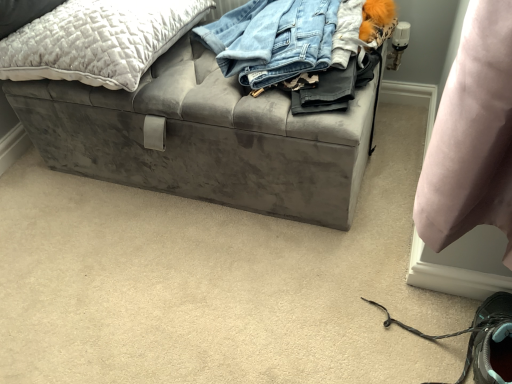
Question: Considering the relative sizes of quilted gray pillow at upper left and gray suede shoe at lower right in the image provided, is quilted gray pillow at upper left thinner than gray suede shoe at lower right?

Choices:
 (A) no
 (B) yes

Answer: (A)

Question: From the image's perspective, would you say quilted gray pillow at upper left is shown under gray suede shoe at lower right?

Choices:
 (A) no
 (B) yes

Answer: (A)

Question: Considering the relative positions of quilted gray pillow at upper left and gray suede shoe at lower right in the image provided, is quilted gray pillow at upper left to the left of gray suede shoe at lower right from the viewer's perspective?

Choices:
 (A) no
 (B) yes

Answer: (B)

Question: Does quilted gray pillow at upper left appear on the right side of gray suede shoe at lower right?

Choices:
 (A) no
 (B) yes

Answer: (A)

Question: Is quilted gray pillow at upper left positioned far away from gray suede shoe at lower right?

Choices:
 (A) no
 (B) yes

Answer: (A)

Question: From a real-world perspective, relative to quilted gray pillow at upper left, is gray suede shoe at lower right vertically above or below?

Choices:
 (A) below
 (B) above

Answer: (A)

Question: Visually, is gray suede shoe at lower right positioned to the left or to the right of quilted gray pillow at upper left?

Choices:
 (A) left
 (B) right

Answer: (B)

Question: Is gray suede shoe at lower right inside or outside of quilted gray pillow at upper left?

Choices:
 (A) outside
 (B) inside

Answer: (A)

Question: Does point (418, 334) appear closer or farther from the camera than point (75, 57)?

Choices:
 (A) farther
 (B) closer

Answer: (B)

Question: In terms of width, does quilted gray pillow at upper left look wider or thinner when compared to velvet gray storage bench at center?

Choices:
 (A) wide
 (B) thin

Answer: (B)

Question: From a real-world perspective, is quilted gray pillow at upper left physically located above or below velvet gray storage bench at center?

Choices:
 (A) above
 (B) below

Answer: (A)

Question: Considering the positions of quilted gray pillow at upper left and velvet gray storage bench at center in the image, is quilted gray pillow at upper left taller or shorter than velvet gray storage bench at center?

Choices:
 (A) tall
 (B) short

Answer: (B)

Question: Is point (120, 11) positioned closer to the camera than point (346, 125)?

Choices:
 (A) farther
 (B) closer

Answer: (A)

Question: Considering the positions of point (380, 309) and point (92, 158), is point (380, 309) closer or farther from the camera than point (92, 158)?

Choices:
 (A) farther
 (B) closer

Answer: (B)

Question: From a real-world perspective, is gray suede shoe at lower right physically located above or below velvet gray storage bench at center?

Choices:
 (A) above
 (B) below

Answer: (B)